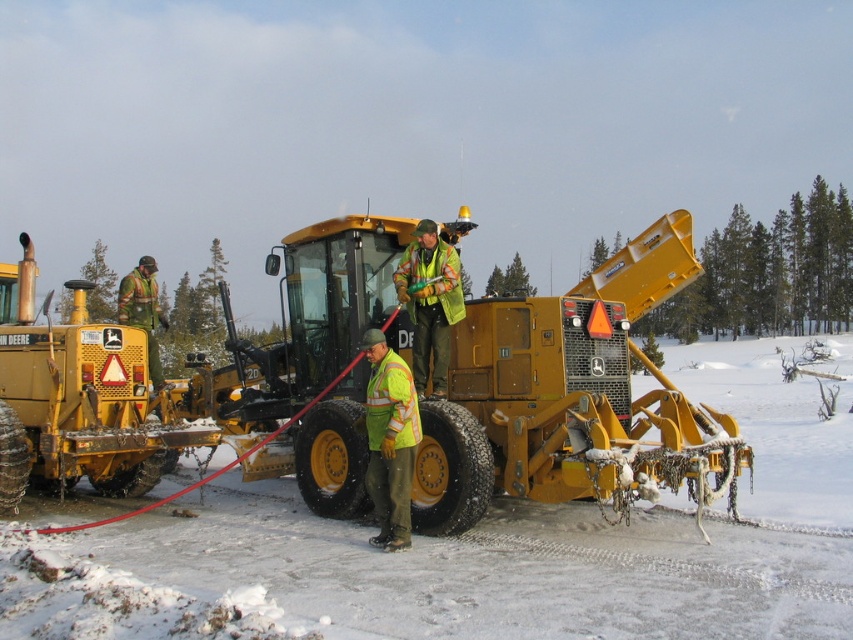
Between point (299, 353) and point (422, 332), which one is positioned in front?

Point (422, 332) is in front.

Does matte yellow tractor at center come in front of reflective yellow safety vest at center?

Yes, it is.

Which is in front, point (532, 388) or point (448, 298)?

Point (532, 388)

Identify the location of matte yellow tractor at center. (567, 396).

Between high-visibility reflective jacket at center and reflective yellow safety vest at center, which one has more height?

With more height is reflective yellow safety vest at center.

What do you see at coordinates (389, 440) in the screenshot?
I see `high-visibility reflective jacket at center` at bounding box center [389, 440].

The height and width of the screenshot is (640, 853). In order to click on high-visibility reflective jacket at center in this screenshot , I will do `click(389, 440)`.

The image size is (853, 640). What are the coordinates of `high-visibility reflective jacket at center` in the screenshot? It's located at (389, 440).

This screenshot has height=640, width=853. I want to click on matte yellow tractor at center, so click(567, 396).

Find the location of `matte yellow tractor at center`. matte yellow tractor at center is located at coordinates (567, 396).